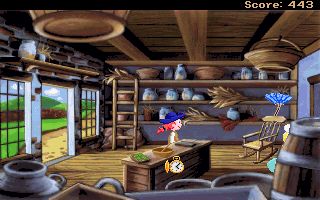
I want to click on ladder, so click(134, 121).